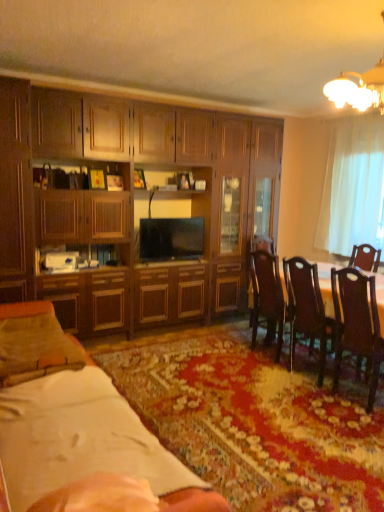
Where is `free spot in front of wooden dining table at center`? The width and height of the screenshot is (384, 512). free spot in front of wooden dining table at center is located at coordinates (297, 438).